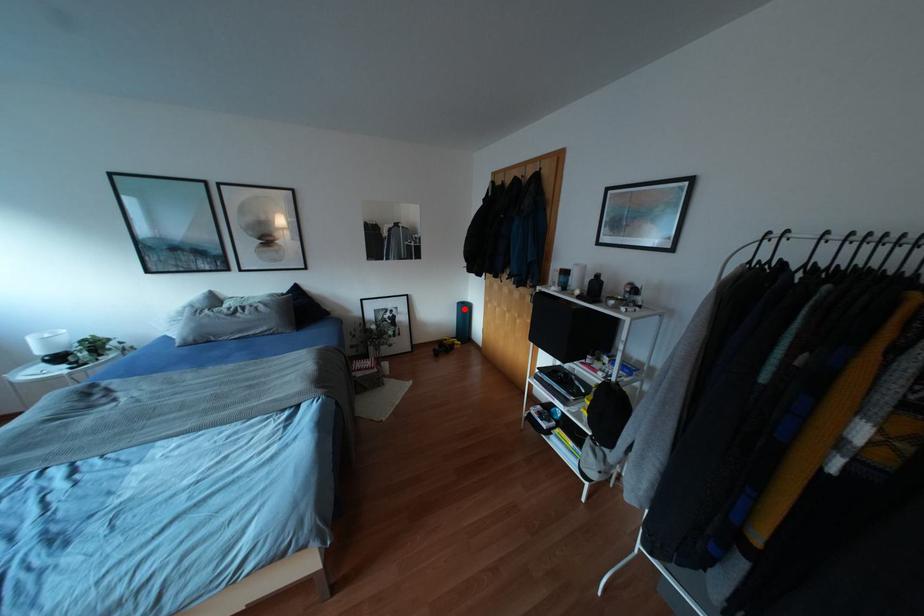
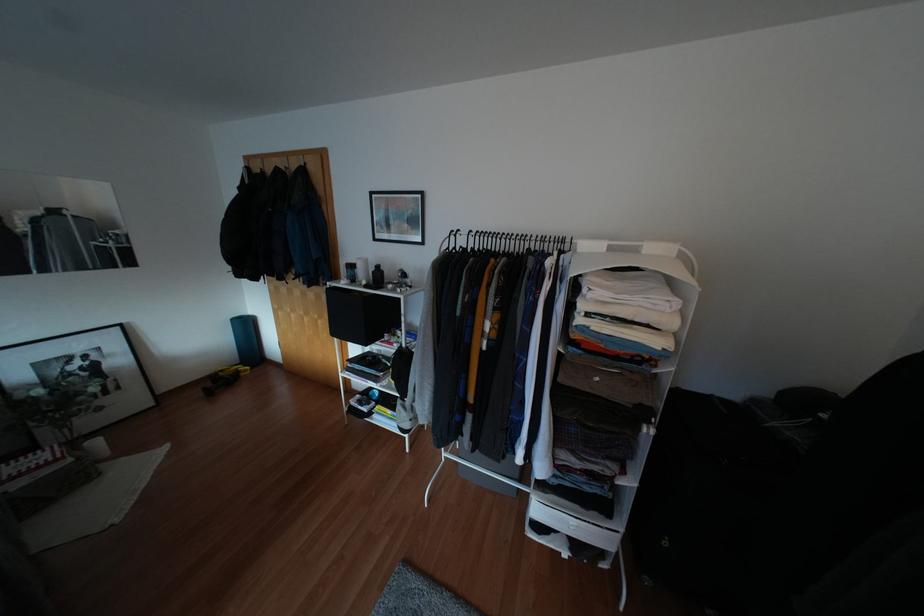
The point at the highlighted location is marked in the first image. Where is the corresponding point in the second image?

(246, 325)